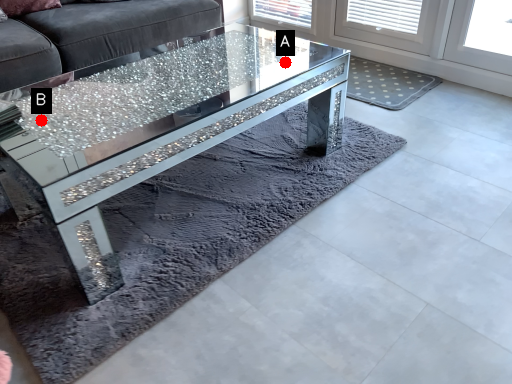
Question: Two points are circled on the image, labeled by A and B beside each circle. Which point is closer to the camera taking this photo?

Choices:
 (A) A is closer
 (B) B is closer

Answer: (B)